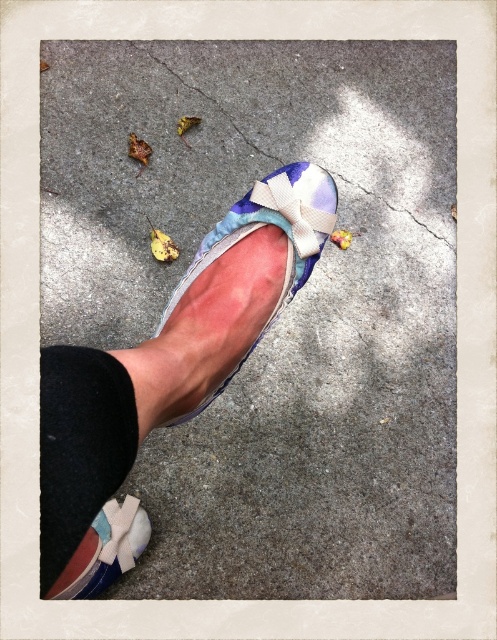
Identify the location of cracked concrete at center. pyautogui.click(x=323, y=120).

Can you confirm if cracked concrete at center is thinner than black fabric ankle at lower left?

Incorrect, cracked concrete at center's width is not less than black fabric ankle at lower left's.

Is point (242, 141) positioned before point (72, 451)?

No, it is not.

Find the location of a particular element. cracked concrete at center is located at coordinates (323, 120).

Is point (205, 205) positioned behind point (301, 188)?

Yes, point (205, 205) is behind point (301, 188).

Image resolution: width=497 pixels, height=640 pixels. What do you see at coordinates (323, 120) in the screenshot?
I see `cracked concrete at center` at bounding box center [323, 120].

Between point (346, 216) and point (322, 172), which one is positioned behind?

Positioned behind is point (346, 216).

You are a GUI agent. You are given a task and a screenshot of the screen. Output one action in this format:
    pyautogui.click(x=<x>, y=<y>)
    Task: Click on the cracked concrete at center
    
    Given the screenshot: What is the action you would take?
    pyautogui.click(x=323, y=120)

Does gray concrete sidewalk at center have a lesser height compared to matte fabric shoe at lower left?

No, gray concrete sidewalk at center is not shorter than matte fabric shoe at lower left.

Who is more distant from viewer, (91, 212) or (120, 547)?

The point (91, 212) is behind.

This screenshot has height=640, width=497. Identify the location of gray concrete sidewalk at center. (284, 312).